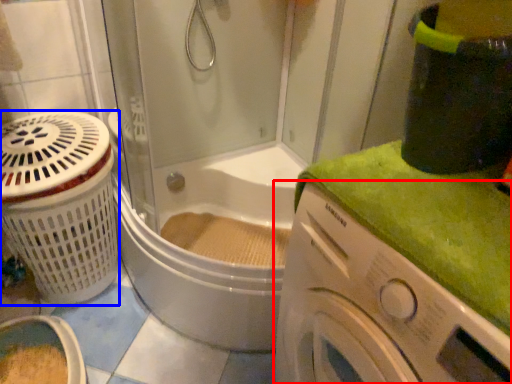
Question: Which object appears farthest to the camera in this image, washing machine (highlighted by a red box) or basket (highlighted by a blue box)?

Choices:
 (A) washing machine
 (B) basket

Answer: (B)